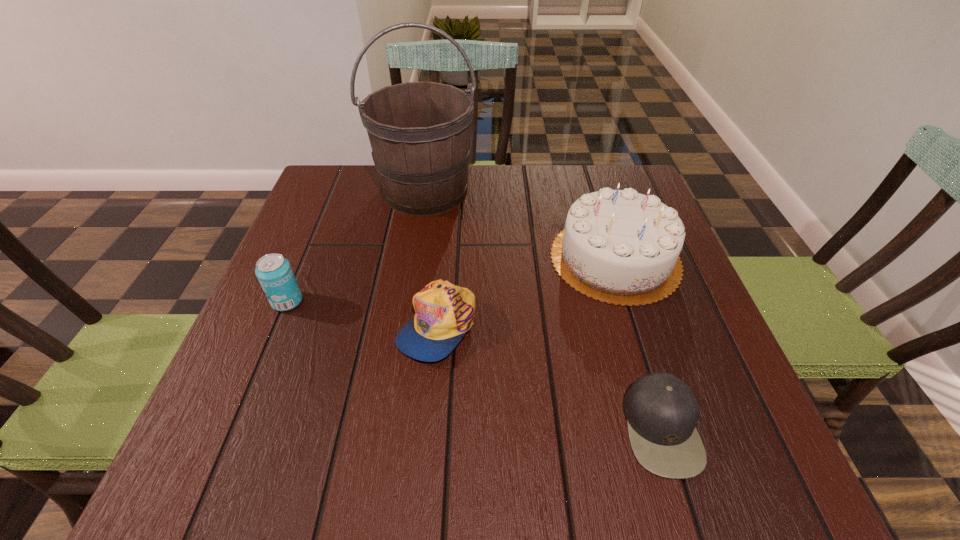
Find the location of a particular element. This screenshot has width=960, height=540. free space between the left cap and the nearest object is located at coordinates (549, 376).

Identify the location of free spot between the birthday cake and the third shortest object. (451, 280).

You are a GUI agent. You are given a task and a screenshot of the screen. Output one action in this format:
    pyautogui.click(x=<x>, y=<y>)
    Task: Click on the free area in between the farther cap and the bucket
    The width and height of the screenshot is (960, 540).
    Given the screenshot: What is the action you would take?
    pyautogui.click(x=431, y=258)

Find the location of a particular element. The image size is (960, 540). free space between the left cap and the tallest object is located at coordinates (431, 258).

The image size is (960, 540). In order to click on free space between the beer can and the birthday cake in this screenshot , I will do `click(451, 280)`.

The height and width of the screenshot is (540, 960). I want to click on vacant point located between the left cap and the birthday cake, so click(x=526, y=291).

The width and height of the screenshot is (960, 540). In order to click on free space between the nearer cap and the farther cap in this screenshot , I will do `click(549, 376)`.

Find the location of a particular element. Image resolution: width=960 pixels, height=540 pixels. blank region between the nearest object and the third tallest object is located at coordinates (474, 364).

The height and width of the screenshot is (540, 960). What are the coordinates of `free point between the farther cap and the third tallest object` in the screenshot? It's located at (362, 313).

What are the coordinates of `the second closest object to the nearest object` in the screenshot? It's located at (444, 312).